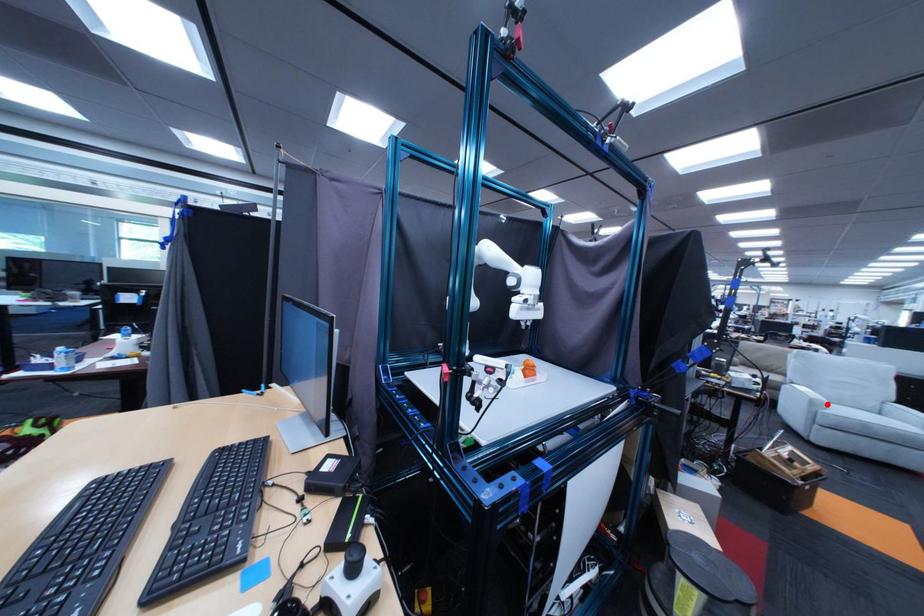
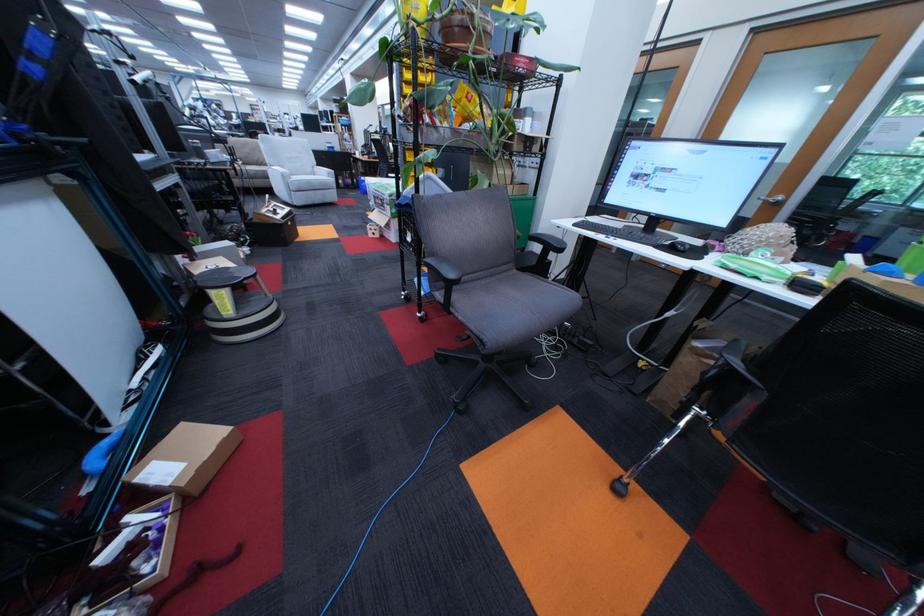
Question: I am providing you with two images of the same scene from different viewpoints. Given a red point in image1, look at the same physical point in image2. Is it:

Choices:
 (A) Closer to the viewpoint
 (B) Farther from the viewpoint

Answer: (A)